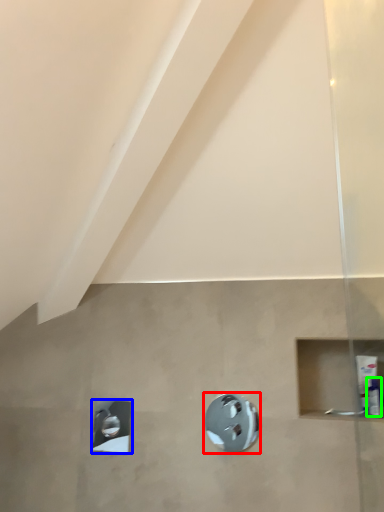
Question: Which is nearer to the shower (highlighted by a red box)? shower (highlighted by a blue box) or toiletry (highlighted by a green box).

Choices:
 (A) shower
 (B) toiletry

Answer: (A)